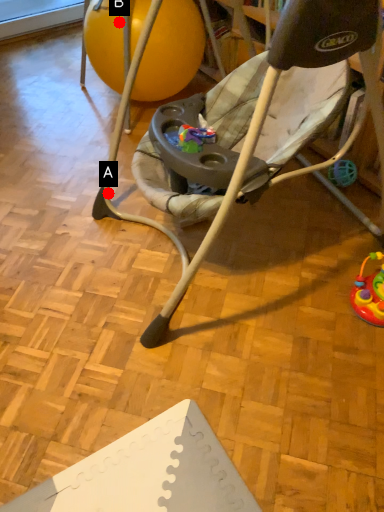
Question: Two points are circled on the image, labeled by A and B beside each circle. Which point is closer to the camera?

Choices:
 (A) A is closer
 (B) B is closer

Answer: (A)